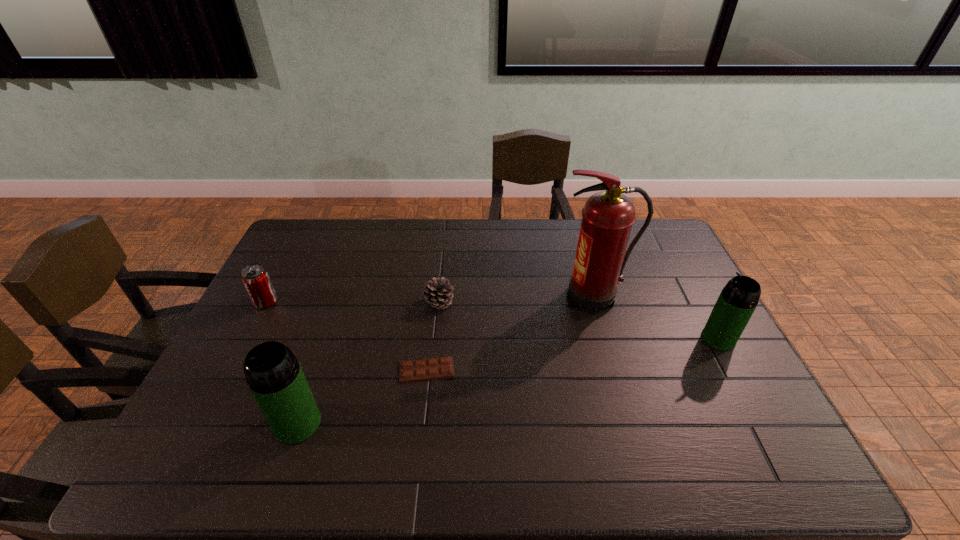
Where is `free space that is in between the shortest object and the fifth tallest object`? The height and width of the screenshot is (540, 960). free space that is in between the shortest object and the fifth tallest object is located at coordinates (433, 336).

At what (x,y) coordinates should I click in order to perform the action: click on free space that is in between the pinecone and the right thermos bottle. Please return your answer as a coordinate pair (x, y). Image resolution: width=960 pixels, height=540 pixels. Looking at the image, I should click on (579, 321).

This screenshot has height=540, width=960. Find the location of `free spot between the chocolate bar and the fourth farthest object`. free spot between the chocolate bar and the fourth farthest object is located at coordinates (572, 354).

What are the coordinates of `free spot between the shortest object and the nearest object` in the screenshot? It's located at (362, 396).

The image size is (960, 540). What are the coordinates of `free space that is in between the fifth object from left to right and the fifth tallest object` in the screenshot? It's located at (516, 300).

Locate an element on the screen. The height and width of the screenshot is (540, 960). free space between the fifth object from right to left and the shortest object is located at coordinates (362, 396).

I want to click on empty space that is in between the left thermos bottle and the fifth tallest object, so click(x=369, y=363).

Find the location of a particular element. free space between the chocolate bar and the shorter thermos bottle is located at coordinates (572, 354).

Identify the location of object that is the fifth nearest to the fourth tallest object. This screenshot has height=540, width=960. (736, 303).

You are a GUI agent. You are given a task and a screenshot of the screen. Output one action in this format:
    pyautogui.click(x=<x>, y=<y>)
    Task: Click on the fifth closest object to the shortest object
    Image resolution: width=960 pixels, height=540 pixels.
    Given the screenshot: What is the action you would take?
    pyautogui.click(x=736, y=303)